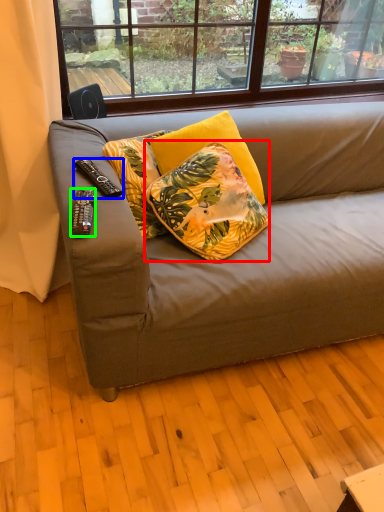
Question: Based on their relative distances, which object is nearer to pillow (highlighted by a red box)? Choose from remote control (highlighted by a blue box) and remote control (highlighted by a green box).

Choices:
 (A) remote control
 (B) remote control

Answer: (A)